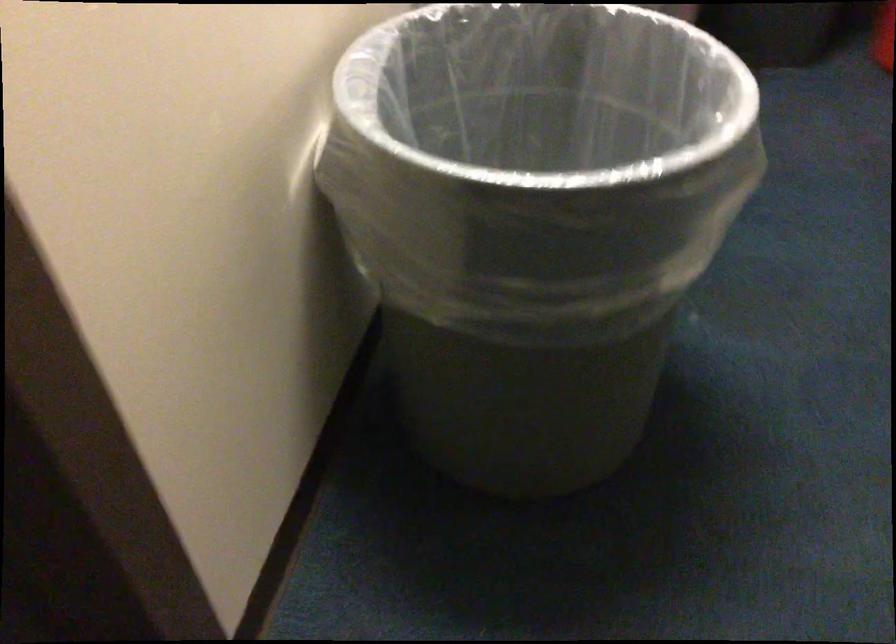
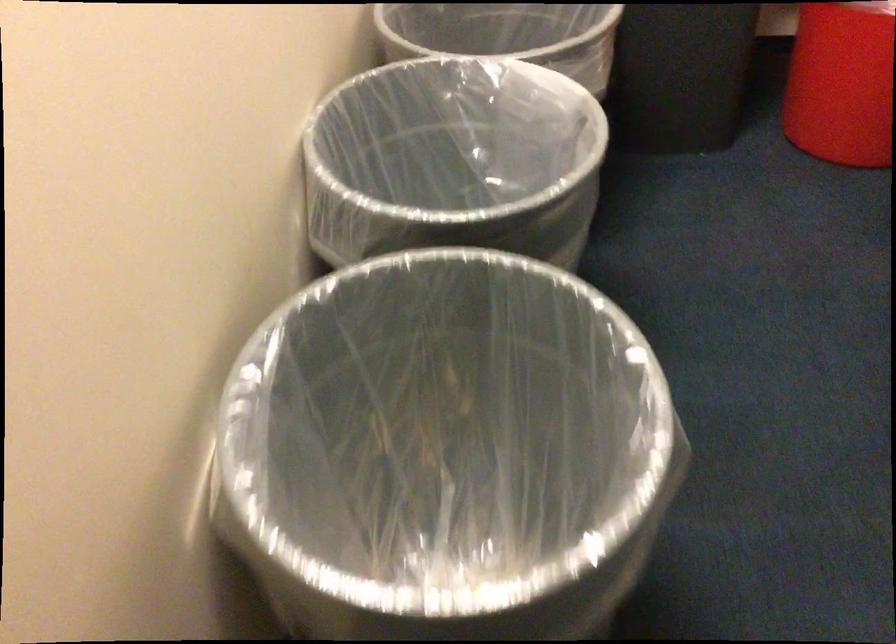
Question: How did the camera likely rotate?

Choices:
 (A) Left
 (B) Right
 (C) Up
 (D) Down

Answer: (B)